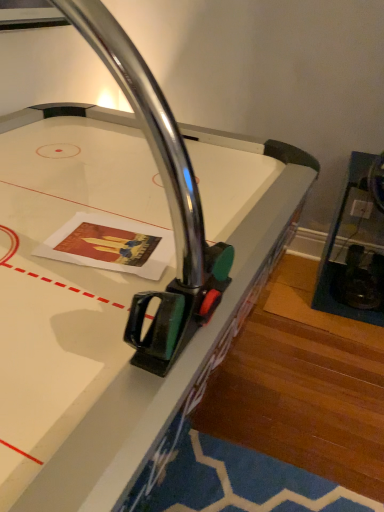
Question: From a real-world perspective, does metallic glass shelf at right sit lower than metallic air hockey table at center?

Choices:
 (A) yes
 (B) no

Answer: (A)

Question: Does metallic glass shelf at right have a greater width compared to metallic air hockey table at center?

Choices:
 (A) no
 (B) yes

Answer: (A)

Question: Is metallic glass shelf at right facing towards metallic air hockey table at center?

Choices:
 (A) no
 (B) yes

Answer: (A)

Question: Is metallic glass shelf at right thinner than metallic air hockey table at center?

Choices:
 (A) yes
 (B) no

Answer: (A)

Question: Is metallic glass shelf at right surrounding metallic air hockey table at center?

Choices:
 (A) yes
 (B) no

Answer: (B)

Question: Is metallic glass shelf at right outside of metallic air hockey table at center?

Choices:
 (A) no
 (B) yes

Answer: (B)

Question: Can you confirm if metallic air hockey table at center is positioned to the right of metallic glass shelf at right?

Choices:
 (A) yes
 (B) no

Answer: (B)

Question: Can you confirm if metallic air hockey table at center is wider than metallic glass shelf at right?

Choices:
 (A) no
 (B) yes

Answer: (B)

Question: From the image's perspective, is metallic air hockey table at center below metallic glass shelf at right?

Choices:
 (A) no
 (B) yes

Answer: (B)

Question: From the image's perspective, is metallic air hockey table at center above metallic glass shelf at right?

Choices:
 (A) no
 (B) yes

Answer: (A)

Question: Is the position of metallic air hockey table at center more distant than that of metallic glass shelf at right?

Choices:
 (A) yes
 (B) no

Answer: (B)

Question: From a real-world perspective, is metallic air hockey table at center physically above metallic glass shelf at right?

Choices:
 (A) yes
 (B) no

Answer: (A)

Question: Considering the positions of metallic glass shelf at right and metallic air hockey table at center in the image, is metallic glass shelf at right taller or shorter than metallic air hockey table at center?

Choices:
 (A) tall
 (B) short

Answer: (B)